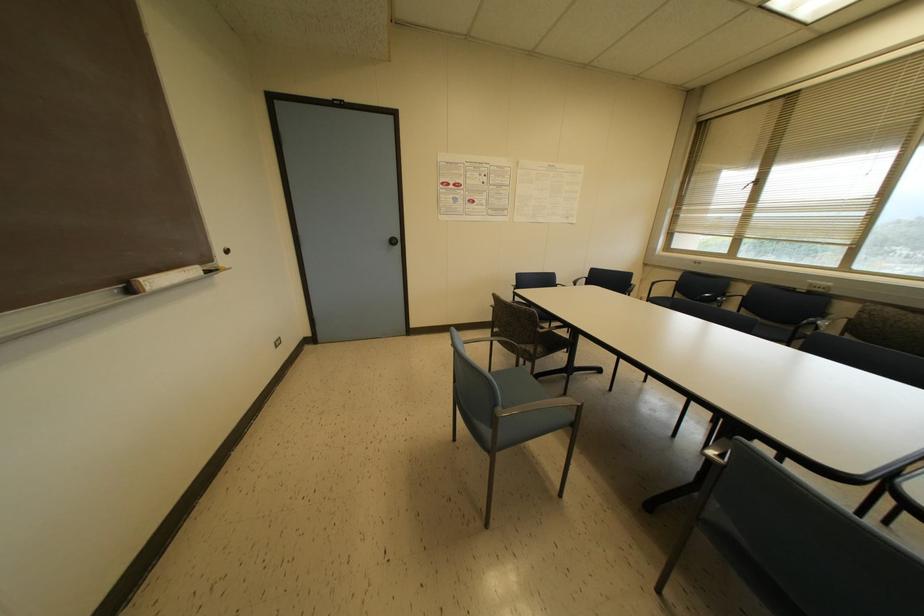
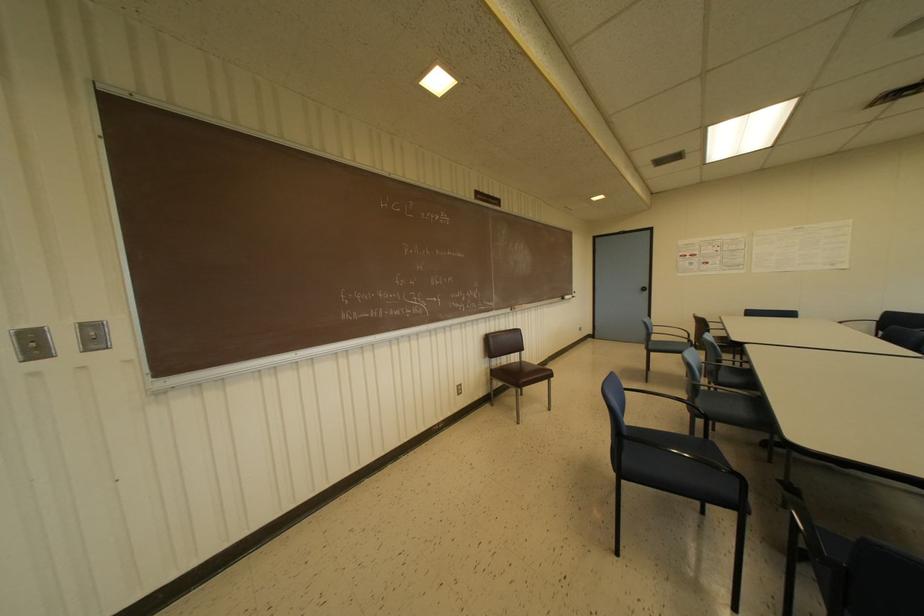
In the second image, find the point that corresponds to pixel 397 241 in the first image.

(646, 288)